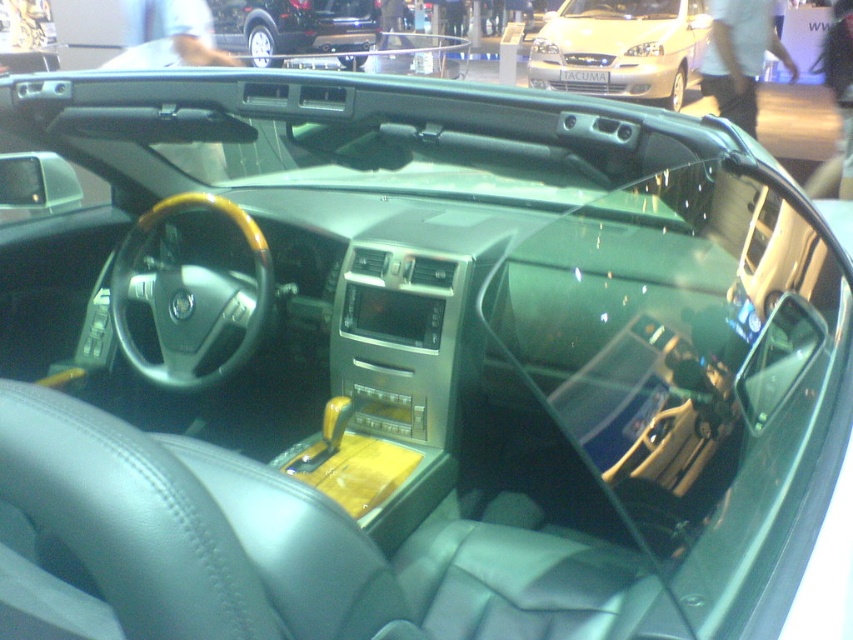
You are a photographer trying to capture both the silver metallic sedan at upper center and the shiny black car at upper center in a single shot. Given their sizes, which car should you position closer to the camera to ensure both appear roughly the same size in the photo?

To make both cars appear roughly the same size in the photo, position the shiny black car at upper center closer to the camera since it is smaller than the silver metallic sedan at upper center. This adjustment will balance their apparent sizes in the frame.

You are a photographer standing in the auto show, and you want to take a photo of both the silver metallic sedan at upper center and the shiny black car at upper center in the same frame. Given that your camera has a 50mm lens, which has a field of view that can capture objects up to 12 feet apart, will you be able to fit both cars in the frame?

The silver metallic sedan at upper center and the shiny black car at upper center are 12.39 feet apart. Since the camera lens can only capture up to 12 feet, the distance between them exceeds the maximum coverage. Therefore, both cars cannot be captured in the same frame.

You are a photographer standing in the auto show and want to capture both the silver metallic sedan at upper center and the shiny black car at upper center in a single photo. Which car should you position closer to the camera to ensure both are fully visible?

To ensure both the silver metallic sedan at upper center and the shiny black car at upper center are fully visible in a single photo, position the silver metallic sedan at upper center closer to the camera. Since the silver metallic sedan at upper center is below the shiny black car at upper center, adjusting their positions so the lower one is nearer will help frame both effectively without cropping either out.